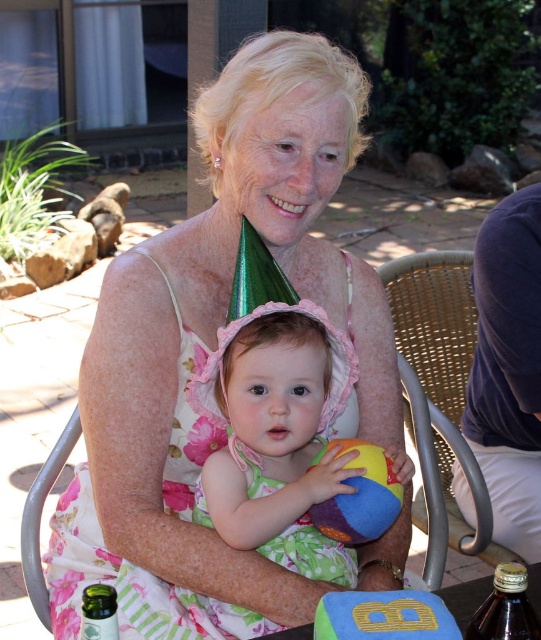
Question: Which of these objects is positioned closest to the green glass bottle at lower left?

Choices:
 (A) green rubber block at center
 (B) matte floral dress at center

Answer: (A)

Question: Where is matte floral dress at center located in relation to green rubber block at center in the image?

Choices:
 (A) right
 (B) left

Answer: (B)

Question: Which object is positioned farthest from the multicolored fabric beach ball at center?

Choices:
 (A) green glass bottle at lower left
 (B) brown glass bottle at lower right
 (C) matte floral dress at center
 (D) woven rattan chair at right

Answer: (D)

Question: Which of the following is the farthest from the observer?

Choices:
 (A) multicolored fabric beach ball at center
 (B) woven rattan chair at right

Answer: (B)

Question: In this image, where is matte floral dress at center located relative to brown glass bottle at lower right?

Choices:
 (A) left
 (B) right

Answer: (A)

Question: Can you confirm if multicolored fabric beach ball at center is positioned above brown glass bottle at lower right?

Choices:
 (A) yes
 (B) no

Answer: (A)